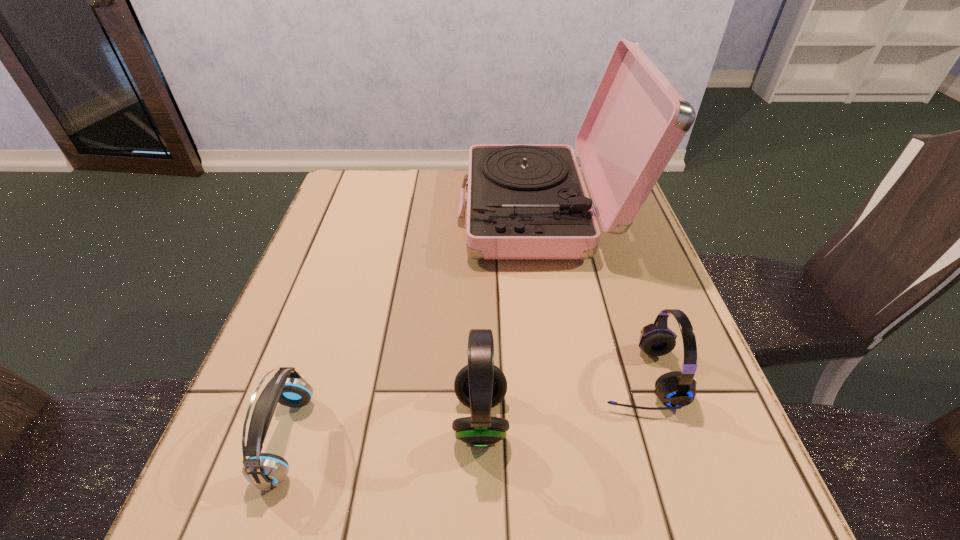
Where is `record player`? This screenshot has height=540, width=960. record player is located at coordinates (525, 201).

Image resolution: width=960 pixels, height=540 pixels. Identify the location of the tallest object. (525, 201).

Locate an element on the screen. This screenshot has width=960, height=540. the second tallest object is located at coordinates (480, 385).

This screenshot has width=960, height=540. In order to click on the tallest headset in this screenshot , I will do pyautogui.click(x=480, y=385).

Identify the location of the second tallest headset. This screenshot has height=540, width=960. (675, 389).

The height and width of the screenshot is (540, 960). I want to click on the rightmost headset, so click(675, 389).

Find the location of a particular element. This screenshot has height=540, width=960. the leftmost headset is located at coordinates (265, 471).

Identify the location of the shortest object. (265, 471).

I want to click on free space located 0.320m with the lid open on the farthest object, so click(x=340, y=212).

I want to click on free spot located 0.100m with the lid open on the farthest object, so click(421, 212).